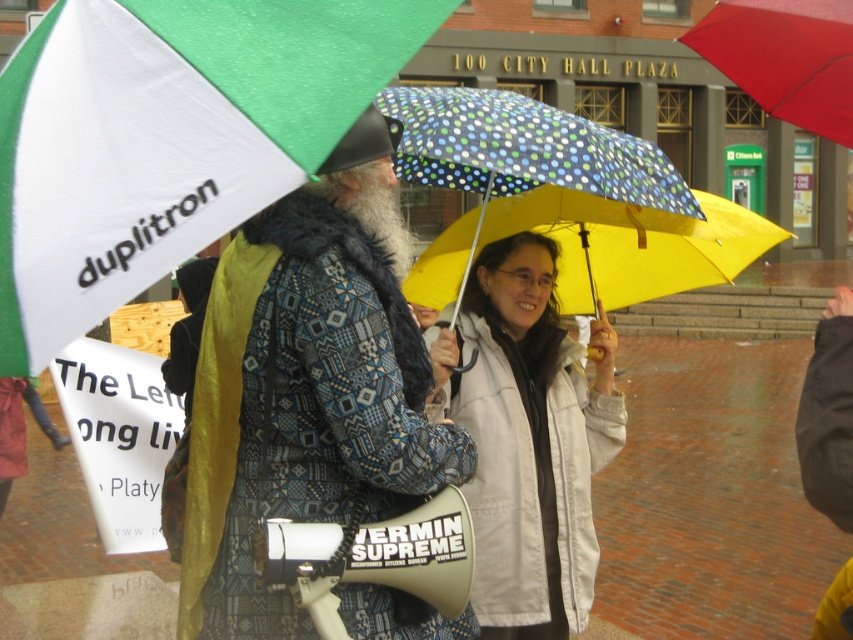
Question: Can you confirm if green fabric umbrella at upper left is thinner than red matte umbrella at upper right?

Choices:
 (A) no
 (B) yes

Answer: (A)

Question: Which of the following is the farthest from the observer?

Choices:
 (A) (822, 13)
 (B) (553, 208)
 (C) (563, 444)
 (D) (339, 422)

Answer: (B)

Question: Does white matte jacket at center have a larger size compared to yellowpolyesterumbrella at center?

Choices:
 (A) no
 (B) yes

Answer: (B)

Question: Does green fabric umbrella at upper left have a larger size compared to white matte jacket at center?

Choices:
 (A) yes
 (B) no

Answer: (B)

Question: Which of these objects is positioned closest to the white matte jacket at center?

Choices:
 (A) red matte umbrella at upper right
 (B) green fabric umbrella at upper left
 (C) patterned fabric coat at center
 (D) yellowpolyesterumbrella at center

Answer: (D)

Question: Which object is positioned farthest from the green fabric umbrella at upper left?

Choices:
 (A) red matte umbrella at upper right
 (B) yellowpolyesterumbrella at center
 (C) white matte jacket at center

Answer: (B)